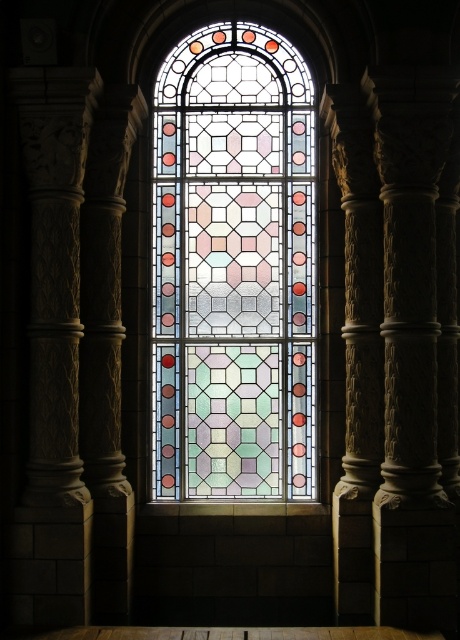
You are an architect examining the stained glass window at center and the carved stone column at left. Based on their positions, which object is positioned higher in the image?

The stained glass window at center is located above the carved stone column at left, so it is positioned higher in the image.

You are standing 30 feet away from the stained glass window and want to take a closer look. If you walk towards the point at coordinates point (299, 108), will you be able to reach it before getting within 29.38 feet of the window?

The distance of point (299, 108) from camera is 29.38 feet. Since you are currently 30 feet away, walking towards the point will bring you to exactly 29.38 feet, which is within your desired distance. Therefore, you can reach the point before getting within 29.38 feet of the window.

You are an architect designing a new building and want to incorporate elements from this image. If you decide to use both the stained glass window at center and the carved stone column at left, which element should be larger to maintain the visual balance of the design?

The stained glass window at center should be larger than the carved stone column at left to maintain the visual balance of the design, as it is already bigger in the original image.